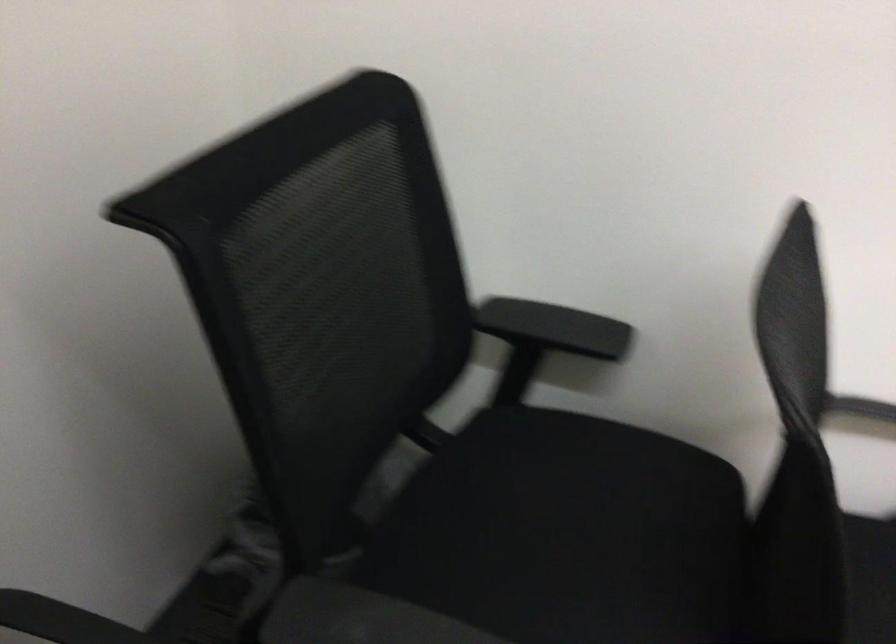
Find where to sit the chair sitting surface. Please return your answer as a coordinate pair (x, y).

(567, 534)